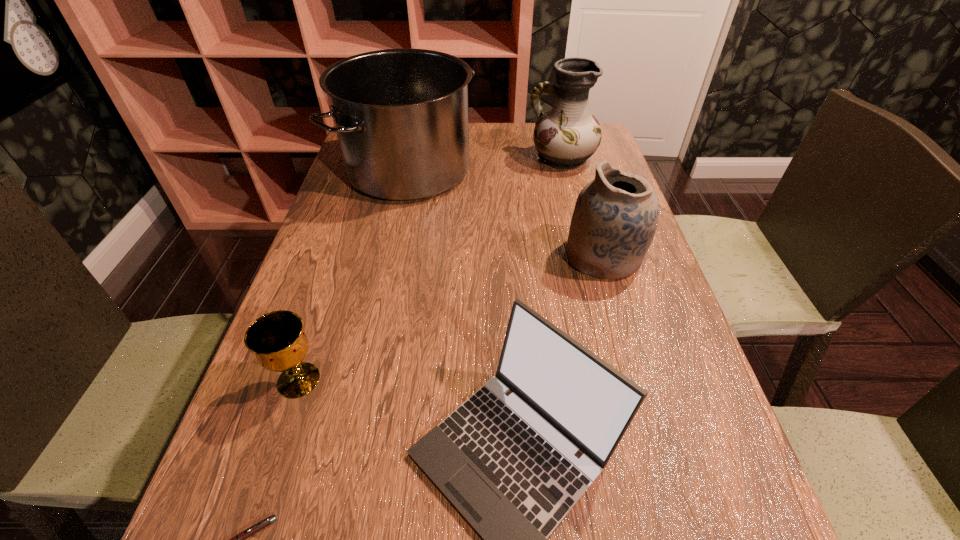
The height and width of the screenshot is (540, 960). Find the location of `saucepan that is at the far edge`. saucepan that is at the far edge is located at coordinates (401, 118).

Locate an element on the screen. saucepan positioned at the left edge is located at coordinates (401, 118).

Image resolution: width=960 pixels, height=540 pixels. In order to click on chalice positioned at the left edge in this screenshot , I will do `click(277, 338)`.

This screenshot has height=540, width=960. Find the location of `vase at the right edge`. vase at the right edge is located at coordinates (566, 136).

At what (x,y) coordinates should I click in order to perform the action: click on pottery located in the right edge section of the desktop. Please return your answer as a coordinate pair (x, y). The image size is (960, 540). Looking at the image, I should click on (615, 217).

Find the location of a particular element. The height and width of the screenshot is (540, 960). object located in the far left corner section of the desktop is located at coordinates (401, 118).

Identify the location of object at the far right corner. This screenshot has height=540, width=960. (566, 136).

Image resolution: width=960 pixels, height=540 pixels. I want to click on free region at the far edge of the desktop, so click(494, 147).

You are a GUI agent. You are given a task and a screenshot of the screen. Output one action in this format:
    pyautogui.click(x=<x>, y=<y>)
    Task: Click on the free spot at the left edge of the desktop
    Image resolution: width=960 pixels, height=540 pixels.
    Given the screenshot: What is the action you would take?
    pyautogui.click(x=309, y=458)

Where is `blank space at the right edge of the desktop`? This screenshot has width=960, height=540. blank space at the right edge of the desktop is located at coordinates (726, 516).